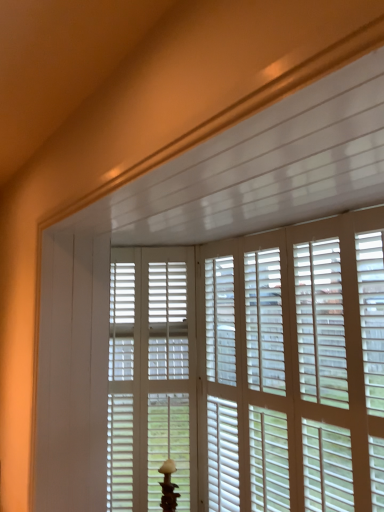
What do you see at coordinates (251, 370) in the screenshot? The image size is (384, 512). I see `white matte window blind at center` at bounding box center [251, 370].

I want to click on white matte screen door at center, so click(151, 377).

At what (x,y) coordinates should I click in order to perform the action: click on white matte table lamp at center. Please return your answer as a coordinate pair (x, y). The width and height of the screenshot is (384, 512). Looking at the image, I should click on [168, 486].

Where is `white matte window blind at center`? This screenshot has width=384, height=512. white matte window blind at center is located at coordinates click(251, 370).

Which is more distant, (283,490) or (171,430)?

Positioned behind is point (171,430).

Considering the positions of objects white matte window blind at center and white matte screen door at center in the image provided, who is in front, white matte window blind at center or white matte screen door at center?

white matte window blind at center.

Can you confirm if white matte window blind at center is taller than white matte screen door at center?

In fact, white matte window blind at center may be shorter than white matte screen door at center.

How many degrees apart are the facing directions of white matte window blind at center and white matte screen door at center?

53.3 degrees separate the facing orientations of white matte window blind at center and white matte screen door at center.

From a real-world perspective, which is physically above, white matte screen door at center or white matte table lamp at center?

white matte screen door at center, from a real-world perspective.

Is white matte screen door at center placed right next to white matte table lamp at center?

There is a gap between white matte screen door at center and white matte table lamp at center.

Between point (124, 411) and point (169, 484), which one is positioned in front?

The point (169, 484) is closer to the camera.

Identify the location of table lamp below the white matte screen door at center (from a real-world perspective). (168, 486).

Which object is wider, white matte screen door at center or white matte window blind at center?

With larger width is white matte screen door at center.

Who is taller, white matte screen door at center or white matte window blind at center?

white matte screen door at center is taller.

Between white matte screen door at center and white matte window blind at center, which one is positioned behind?

white matte screen door at center is behind.

I want to click on window blind that is in front of the white matte screen door at center, so click(251, 370).

Which point is more forward, (166, 503) or (151, 476)?

Point (166, 503)

Is white matte table lamp at center completely or partially outside of white matte screen door at center?

Yes.

Between white matte table lamp at center and white matte screen door at center, which one appears on the left side from the viewer's perspective?

Positioned to the left is white matte screen door at center.

Is white matte table lamp at center taller than white matte screen door at center?

No.

Does point (182, 318) appear closer or farther from the camera than point (169, 472)?

Point (182, 318) is positioned farther from the camera compared to point (169, 472).

Can we say white matte window blind at center lies outside white matte table lamp at center?

white matte window blind at center lies outside white matte table lamp at center's area.

Considering the sizes of objects white matte window blind at center and white matte table lamp at center in the image provided, who is wider, white matte window blind at center or white matte table lamp at center?

Wider between the two is white matte table lamp at center.

Which is in front, white matte window blind at center or white matte table lamp at center?

Positioned in front is white matte window blind at center.

Is point (171, 510) behind point (360, 252)?

Yes, point (171, 510) is behind point (360, 252).

Does white matte table lamp at center appear on the right side of white matte window blind at center?

In fact, white matte table lamp at center is to the left of white matte window blind at center.

Locate an element on the screen. This screenshot has width=384, height=512. window blind that appears above the white matte table lamp at center (from the image's perspective) is located at coordinates (251, 370).

From a real-world perspective, is white matte table lamp at center under white matte window blind at center?

Indeed, from a real-world perspective, white matte table lamp at center is positioned beneath white matte window blind at center.

The width and height of the screenshot is (384, 512). I want to click on screen door below the white matte window blind at center (from a real-world perspective), so click(151, 377).

The image size is (384, 512). I want to click on table lamp that appears below the white matte screen door at center (from the image's perspective), so click(x=168, y=486).

Looking at the image, which one is located closer to white matte screen door at center, white matte table lamp at center or white matte window blind at center?

white matte window blind at center.

Which object lies nearer to the anchor point white matte window blind at center, white matte table lamp at center or white matte screen door at center?

white matte screen door at center.

Based on the photo, considering their positions, is white matte window blind at center positioned closer to white matte table lamp at center than white matte screen door at center?

white matte screen door at center.

Looking at the image, which one is located closer to white matte table lamp at center, white matte screen door at center or white matte window blind at center?

white matte screen door at center.

Estimate the real-world distances between objects in this image. Which object is closer to white matte screen door at center, white matte window blind at center or white matte table lamp at center?

The object closer to white matte screen door at center is white matte window blind at center.

Looking at the image, which one is located further to white matte window blind at center, white matte screen door at center or white matte table lamp at center?

Based on the image, white matte table lamp at center appears to be further to white matte window blind at center.

This screenshot has height=512, width=384. Find the location of `table lamp positioned between white matte window blind at center and white matte screen door at center from near to far`. table lamp positioned between white matte window blind at center and white matte screen door at center from near to far is located at coordinates (168, 486).